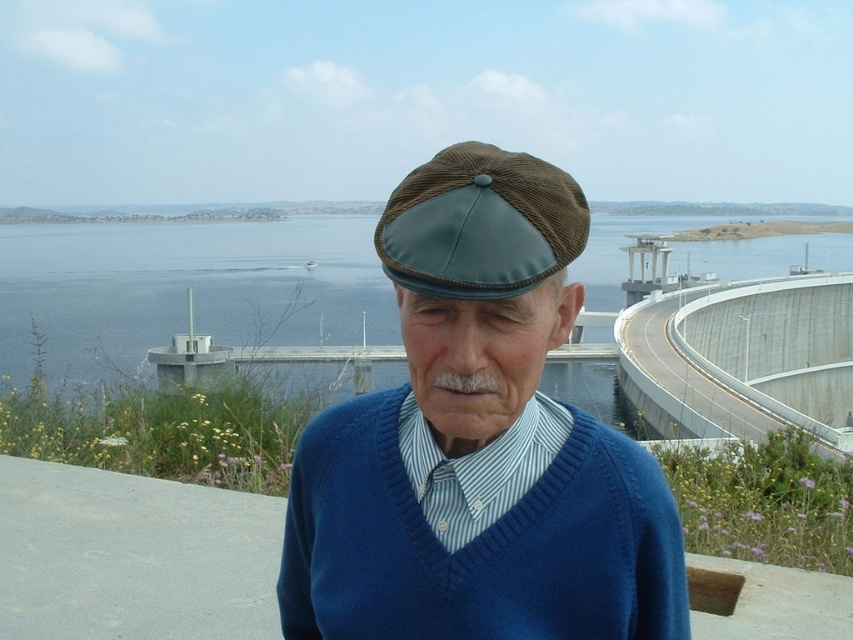
You are a fashion designer analyzing the outfit of the elderly man in the image. Which item, the matte brown leather cap at center or the blue knitted sweater at center, has a greater height?

The matte brown leather cap at center is taller than the blue knitted sweater at center, so the cap has a greater height.